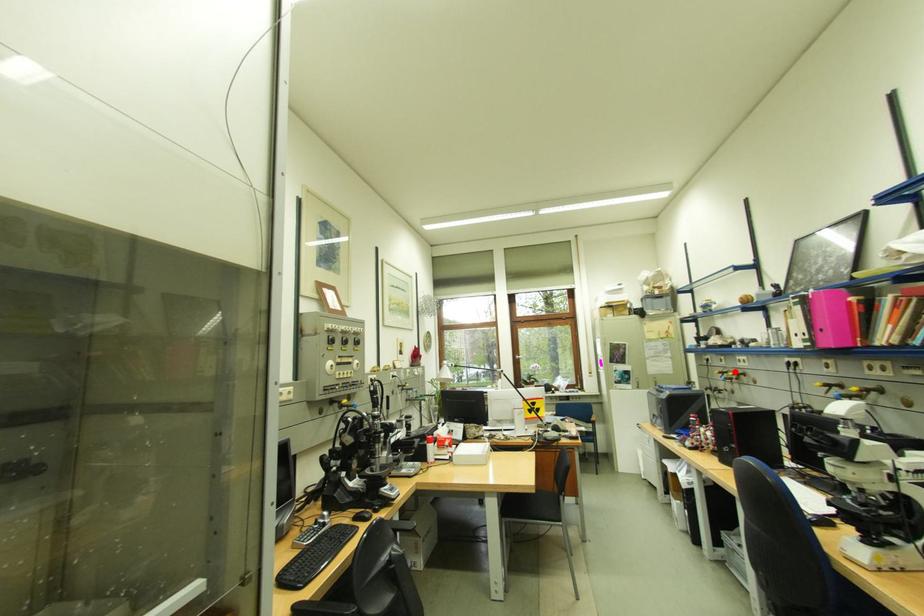
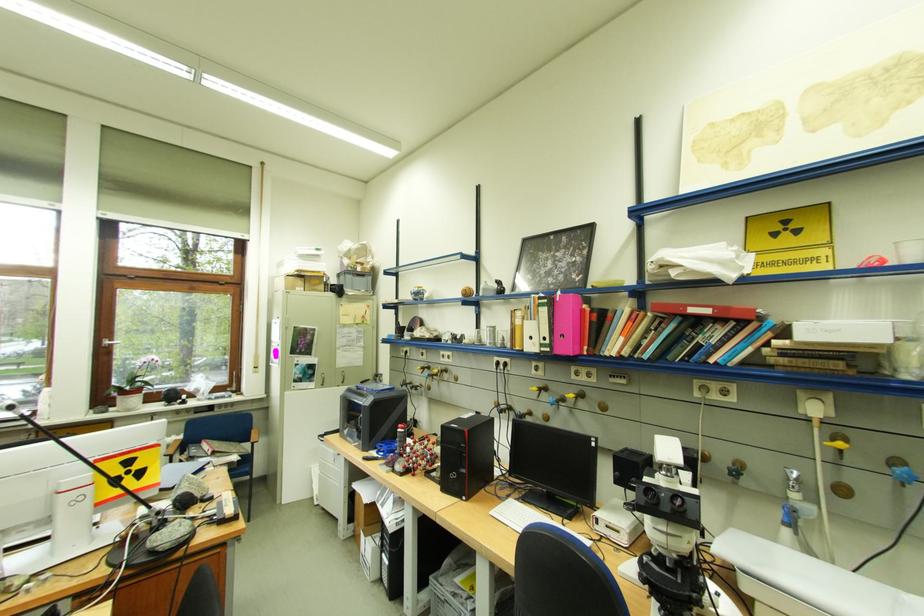
Locate, in the second image, the point that corresponds to the highlighted location in the first image.

(435, 367)